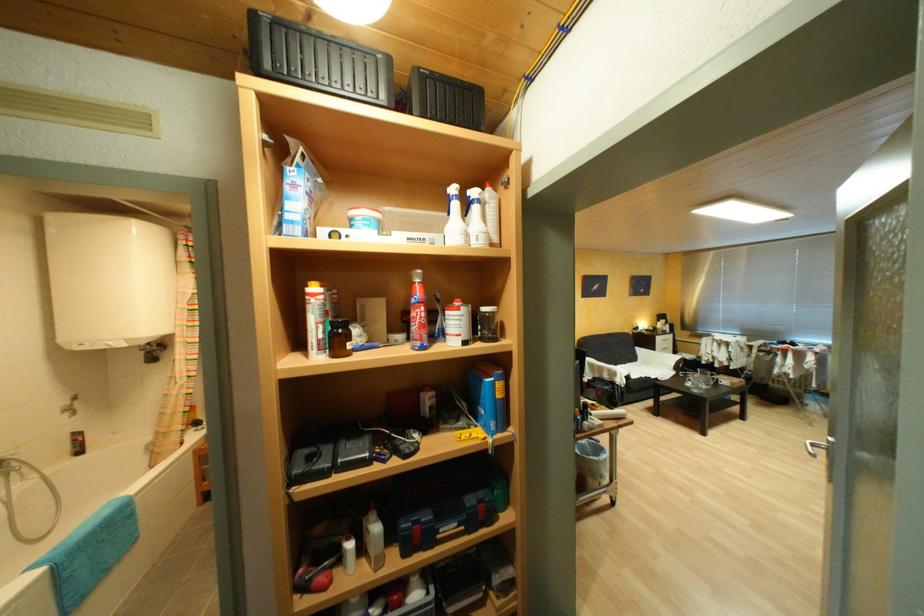
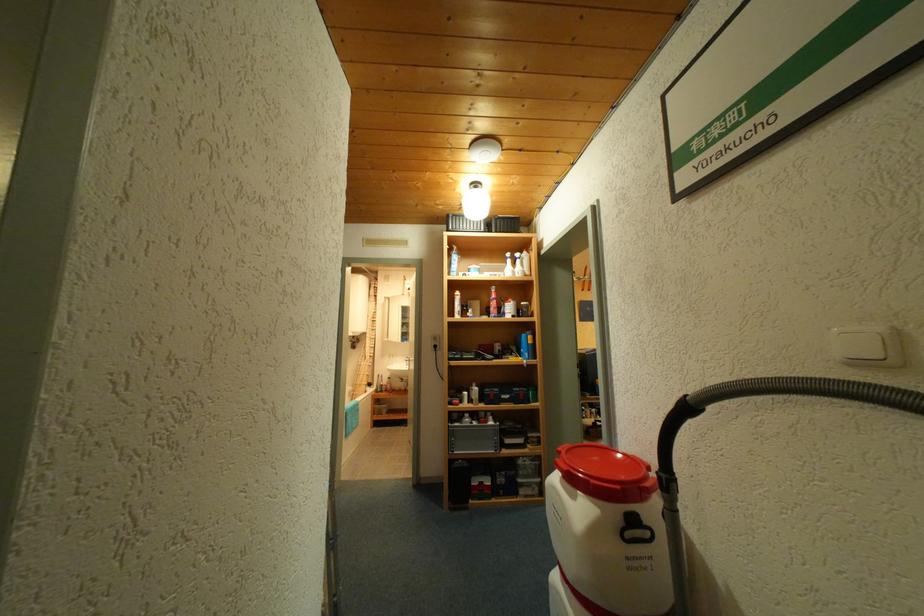
Find the pixel in the second image that matches point (483, 193) in the first image.

(527, 256)